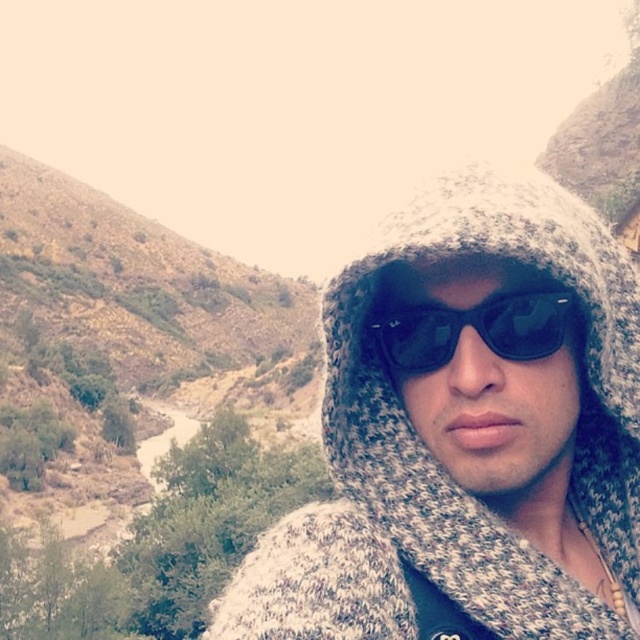
You are a fashion designer analyzing the image. You need to decide which item takes up more space in the composition. Which object is larger in size between the knitted woolen hoodie at center and the black reflective sunglasses at center?

The knitted woolen hoodie at center is bigger than the black reflective sunglasses at center, so the knitted woolen hoodie at center takes up more space in the composition.

Consider the image. You are a photographer trying to capture the knitted woolen hoodie at center and the black reflective sunglasses at center in a single frame. Based on their positions, which object should you adjust your camera focus on first if you want to ensure both are in focus?

The knitted woolen hoodie at center is to the left of black reflective sunglasses at center, so you should focus on the knitted woolen hoodie at center first to ensure both are in focus.